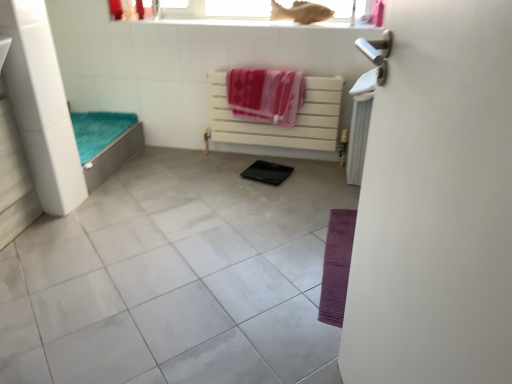
Question: From the image's perspective, is pink fabric beach towel at center, acting as the first beach towel starting from the left, located above white glossy screen door at right?

Choices:
 (A) no
 (B) yes

Answer: (B)

Question: Can you confirm if pink fabric beach towel at center, which ranks as the second beach towel in right-to-left order, is positioned to the left of white glossy screen door at right?

Choices:
 (A) no
 (B) yes

Answer: (B)

Question: Is pink fabric beach towel at center, which ranks as the second beach towel in right-to-left order, touching white glossy screen door at right?

Choices:
 (A) no
 (B) yes

Answer: (A)

Question: Is pink fabric beach towel at center, which ranks as the second beach towel in right-to-left order, shorter than white glossy screen door at right?

Choices:
 (A) yes
 (B) no

Answer: (A)

Question: Can you confirm if pink fabric beach towel at center, acting as the first beach towel starting from the left, is thinner than white glossy screen door at right?

Choices:
 (A) yes
 (B) no

Answer: (A)

Question: Is point (260, 117) positioned closer to the camera than point (345, 370)?

Choices:
 (A) closer
 (B) farther

Answer: (B)

Question: From a real-world perspective, is pink fabric beach towel at center, acting as the first beach towel starting from the left, positioned above or below white glossy screen door at right?

Choices:
 (A) above
 (B) below

Answer: (B)

Question: Is pink fabric beach towel at center, which ranks as the second beach towel in right-to-left order, to the left or to the right of white glossy screen door at right in the image?

Choices:
 (A) left
 (B) right

Answer: (A)

Question: Which is correct: pink fabric beach towel at center, acting as the first beach towel starting from the left, is inside white glossy screen door at right, or outside of it?

Choices:
 (A) outside
 (B) inside

Answer: (A)

Question: Is pink fabric beach towel at center, acting as the first beach towel starting from the left, in front of or behind matte plastic fish at upper center in the image?

Choices:
 (A) behind
 (B) front

Answer: (B)

Question: Is point (290, 124) positioned closer to the camera than point (302, 1)?

Choices:
 (A) farther
 (B) closer

Answer: (A)

Question: Considering the positions of pink fabric beach towel at center, acting as the first beach towel starting from the left, and matte plastic fish at upper center in the image, is pink fabric beach towel at center, acting as the first beach towel starting from the left, bigger or smaller than matte plastic fish at upper center?

Choices:
 (A) big
 (B) small

Answer: (A)

Question: Is pink fabric beach towel at center, which ranks as the second beach towel in right-to-left order, taller or shorter than matte plastic fish at upper center?

Choices:
 (A) short
 (B) tall

Answer: (B)

Question: Considering the relative positions of white glossy screen door at right and pink fabric beach towel at center, acting as the first beach towel starting from the left, in the image provided, is white glossy screen door at right to the left or to the right of pink fabric beach towel at center, acting as the first beach towel starting from the left,?

Choices:
 (A) left
 (B) right

Answer: (B)

Question: From a real-world perspective, is white glossy screen door at right positioned above or below pink fabric beach towel at center, acting as the first beach towel starting from the left?

Choices:
 (A) above
 (B) below

Answer: (A)